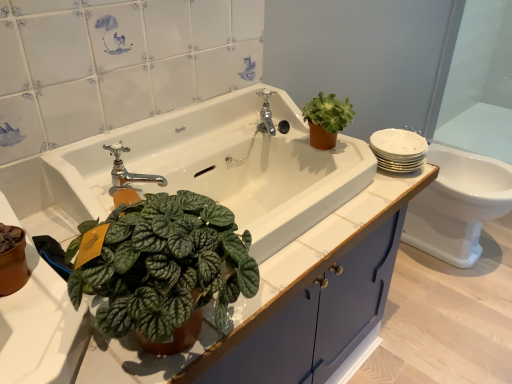
In order to face polished chrome faucet at center, acting as the first tap starting from the front, should I rotate leftwards or rightwards?

Rotate left and turn 15.981 degrees.

You are a GUI agent. You are given a task and a screenshot of the screen. Output one action in this format:
    pyautogui.click(x=<x>, y=<y>)
    Task: Click on the white glossy sink at center
    The image size is (512, 384).
    Given the screenshot: What is the action you would take?
    pyautogui.click(x=222, y=167)

Measure the distance between polished chrome tap at upper center, which ranks as the second tap in left-to-right order, and camera.

polished chrome tap at upper center, which ranks as the second tap in left-to-right order, is 4.02 feet from camera.

Measure the distance between white glossy toilet at right and camera.

They are 5.40 feet apart.

This screenshot has width=512, height=384. Find the location of `blue matte cabinet at center`. blue matte cabinet at center is located at coordinates (313, 290).

The image size is (512, 384). What are the coordinates of `polished chrome faucet at center, acting as the second tap starting from the right` in the screenshot? It's located at (127, 171).

Does polished chrome tap at upper center, which is the first tap in back-to-front order, lie behind polished chrome faucet at center, the second tap positioned from the top?

Yes.

Consider the image. From a real-world perspective, between polished chrome tap at upper center, which is the 1th tap in top-to-bottom order, and polished chrome faucet at center, positioned as the 1th tap in left-to-right order, who is vertically lower?

From a 3D spatial view, polished chrome tap at upper center, which is the 1th tap in top-to-bottom order, is below.

Between point (262, 90) and point (123, 151), which one is positioned in front?

The point (123, 151) is closer.

Does polished chrome tap at upper center, which is the 2th tap in front-to-back order, turn towards polished chrome faucet at center, the second tap positioned from the top?

No, polished chrome tap at upper center, which is the 2th tap in front-to-back order, is not oriented towards polished chrome faucet at center, the second tap positioned from the top.

From a real-world perspective, is polished chrome tap at upper center, which is counted as the 2th tap, starting from the bottom, above or below blue matte cabinet at center?

polished chrome tap at upper center, which is counted as the 2th tap, starting from the bottom, is situated higher than blue matte cabinet at center in the real world.

Is blue matte cabinet at center at the back of polished chrome tap at upper center, which ranks as the second tap in left-to-right order?

No.

From the image's perspective, is polished chrome tap at upper center, which is the first tap in back-to-front order, over blue matte cabinet at center?

Yes.

Which of these two, polished chrome tap at upper center, the first tap positioned from the right, or blue matte cabinet at center, is bigger?

With larger size is blue matte cabinet at center.

Is transparent glass door at upper right to the left of white glossy toilet at right from the viewer's perspective?

No.

Is transparent glass door at upper right oriented away from white glossy toilet at right?

That's not correct — transparent glass door at upper right is not looking away from white glossy toilet at right.

Between point (465, 76) and point (476, 156), which one is positioned in front?

Positioned in front is point (476, 156).

Can you confirm if transparent glass door at upper right is smaller than white glossy toilet at right?

Yes.

Considering the positions of point (116, 159) and point (241, 146), is point (116, 159) closer or farther from the camera than point (241, 146)?

Clearly, point (116, 159) is closer to the camera than point (241, 146).

Which is more to the left, polished chrome faucet at center, the 2th tap in the back-to-front sequence, or white glossy sink at center?

polished chrome faucet at center, the 2th tap in the back-to-front sequence, is more to the left.

Is polished chrome faucet at center, the second tap positioned from the top, oriented towards white glossy sink at center?

Yes, polished chrome faucet at center, the second tap positioned from the top, is facing white glossy sink at center.

Which object is closer to the camera taking this photo, polished chrome faucet at center, acting as the first tap starting from the front, or white glossy sink at center?

white glossy sink at center is more forward.

Is point (328, 320) closer or farther from the camera than point (421, 217)?

Point (328, 320).

Based on the photo, can you confirm if blue matte cabinet at center is shorter than white glossy toilet at right?

No, blue matte cabinet at center is not shorter than white glossy toilet at right.

What are the coordinates of `bathroom cabinet positioned vertically above the white glossy toilet at right (from a real-world perspective)` in the screenshot? It's located at (313, 290).

Is blue matte cabinet at center bigger or smaller than white glossy toilet at right?

blue matte cabinet at center is bigger than white glossy toilet at right.

From a real-world perspective, is polished chrome faucet at center, acting as the first tap starting from the front, positioned under blue matte cabinet at center based on gravity?

No, from a real-world perspective, polished chrome faucet at center, acting as the first tap starting from the front, is not beneath blue matte cabinet at center.

Who is taller, polished chrome faucet at center, the second tap positioned from the top, or blue matte cabinet at center?

blue matte cabinet at center.

Which point is more forward, (118, 147) or (331, 288)?

The point (118, 147) is closer.

Which of these two, polished chrome faucet at center, which is counted as the first tap, starting from the bottom, or blue matte cabinet at center, is wider?

With larger width is blue matte cabinet at center.

Between transparent glass door at upper right and green matte succulent at upper right, which one has more height?

transparent glass door at upper right.

How many degrees apart are the facing directions of transparent glass door at upper right and green matte succulent at upper right?

88 degrees separate the facing orientations of transparent glass door at upper right and green matte succulent at upper right.

From a real-world perspective, is transparent glass door at upper right located beneath green matte succulent at upper right?

Yes, from a real-world perspective, transparent glass door at upper right is under green matte succulent at upper right.

Considering the relative sizes of transparent glass door at upper right and green matte succulent at upper right in the image provided, is transparent glass door at upper right smaller than green matte succulent at upper right?

No, transparent glass door at upper right is not smaller than green matte succulent at upper right.

In the image, there is a polished chrome faucet at center, acting as the second tap starting from the right. Where is `tap below it (from a real-world perspective)`? This screenshot has height=384, width=512. tap below it (from a real-world perspective) is located at coordinates (266, 113).

Where is `bathroom cabinet on the left of polished chrome tap at upper center, which is the 2th tap in front-to-back order`? bathroom cabinet on the left of polished chrome tap at upper center, which is the 2th tap in front-to-back order is located at coordinates (313, 290).

Which object lies further to the anchor point blue matte cabinet at center, white glossy sink at center or white glossy toilet at right?

white glossy toilet at right lies further to blue matte cabinet at center than the other object.

From the image, which object appears to be nearer to polished chrome tap at upper center, the first tap positioned from the right, green matte succulent at upper right or white glossy sink at center?

Based on the image, green matte succulent at upper right appears to be nearer to polished chrome tap at upper center, the first tap positioned from the right.

From the image, which object appears to be farther from white glossy sink at center, blue matte cabinet at center or polished chrome faucet at center, positioned as the 1th tap in left-to-right order?

blue matte cabinet at center.

From the image, which object appears to be nearer to transparent glass door at upper right, polished chrome faucet at center, which is counted as the first tap, starting from the bottom, or white glossy sink at center?

The object closer to transparent glass door at upper right is white glossy sink at center.

Looking at the image, which one is located closer to transparent glass door at upper right, white glossy toilet at right or green matte succulent at upper right?

Among the two, white glossy toilet at right is located nearer to transparent glass door at upper right.

When comparing their distances from polished chrome faucet at center, the 2th tap in the back-to-front sequence, does transparent glass door at upper right or blue matte cabinet at center seem further?

Based on the image, transparent glass door at upper right appears to be further to polished chrome faucet at center, the 2th tap in the back-to-front sequence.

Which object lies further to the anchor point white glossy sink at center, blue matte cabinet at center or white glossy toilet at right?

The object further to white glossy sink at center is white glossy toilet at right.

Estimate the real-world distances between objects in this image. Which object is closer to blue matte cabinet at center, white glossy sink at center or green matte succulent at upper right?

The object closer to blue matte cabinet at center is white glossy sink at center.

Find the location of a particular element. Image resolution: width=512 pixels, height=384 pixels. bathroom cabinet between polished chrome faucet at center, acting as the second tap starting from the right, and white glossy toilet at right is located at coordinates (313, 290).

The height and width of the screenshot is (384, 512). Identify the location of toilet between white glossy sink at center and transparent glass door at upper right in the horizontal direction. (457, 205).

The width and height of the screenshot is (512, 384). I want to click on tap between white glossy sink at center and white glossy toilet at right from left to right, so click(266, 113).

I want to click on sink between blue matte cabinet at center and transparent glass door at upper right along the z-axis, so click(222, 167).